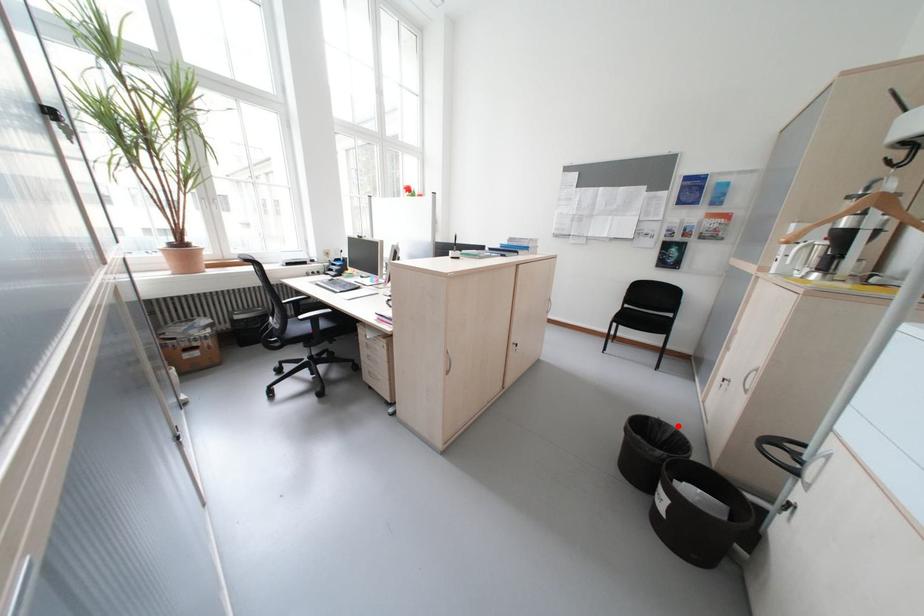
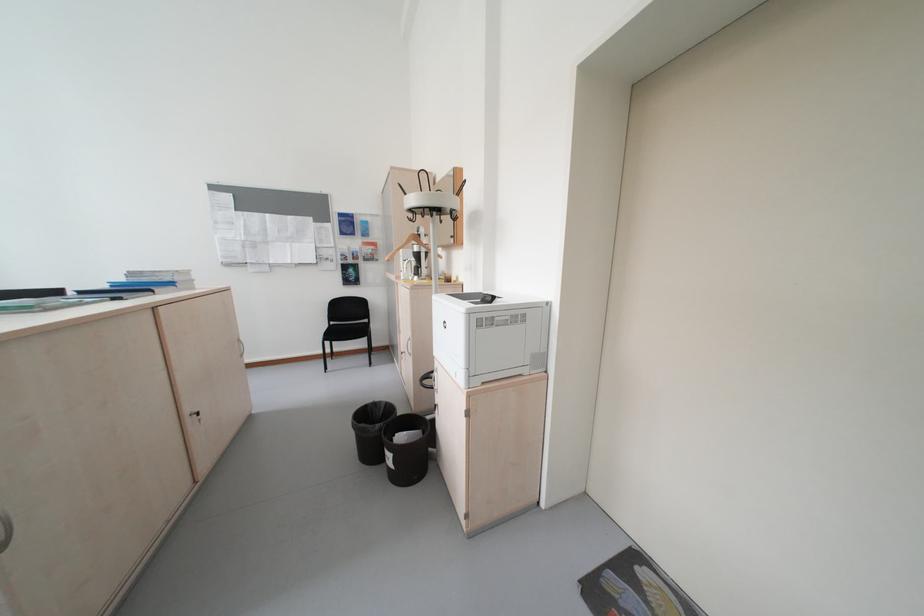
Question: I am providing you with two images of the same scene from different viewpoints. A red point is shown in image1. For the corresponding object point in image2, is it positioned nearer or farther from the camera?

Choices:
 (A) Nearer
 (B) Farther

Answer: (A)